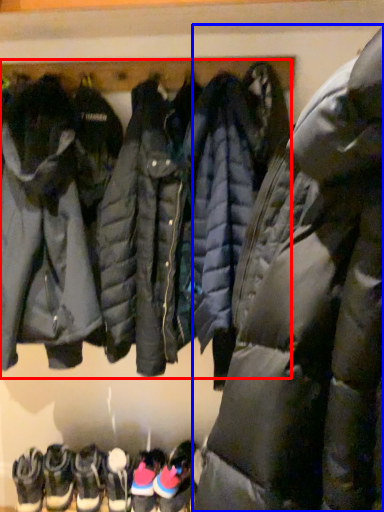
Question: Which object appears farthest to the camera in this image, sweatshirt (highlighted by a red box) or jacket (highlighted by a blue box)?

Choices:
 (A) sweatshirt
 (B) jacket

Answer: (A)